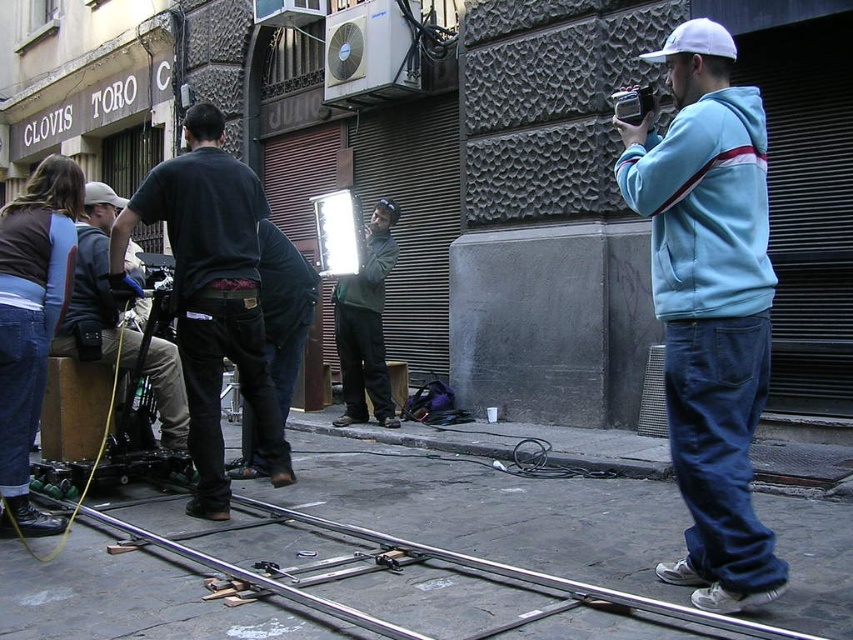
Who is positioned more to the right, black denim jeans at left or matte black camera at left?

Positioned to the right is black denim jeans at left.

Locate an element on the screen. black denim jeans at left is located at coordinates (212, 296).

Is point (190, 132) positioned before point (97, 310)?

Yes, it is in front of point (97, 310).

Image resolution: width=853 pixels, height=640 pixels. In order to click on black denim jeans at left in this screenshot , I will do `click(212, 296)`.

Which is above, matte black camera at left or black plastic video camera at right?

black plastic video camera at right is higher up.

Does matte black camera at left appear on the right side of black plastic video camera at right?

In fact, matte black camera at left is to the left of black plastic video camera at right.

The height and width of the screenshot is (640, 853). Identify the location of matte black camera at left. (97, 291).

Is metallic silver train track at lower center shorter than black plastic video camera at right?

Correct, metallic silver train track at lower center is not as tall as black plastic video camera at right.

What do you see at coordinates (442, 518) in the screenshot? I see `metallic silver train track at lower center` at bounding box center [442, 518].

Which is behind, point (599, 573) or point (640, 90)?

The point (599, 573) is more distant.

Identify the location of metallic silver train track at lower center. (442, 518).